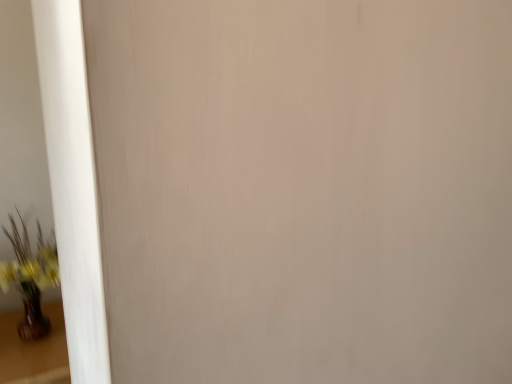
Question: Is brown glossy vase at lower left smaller than matte brown vase at lower left?

Choices:
 (A) yes
 (B) no

Answer: (B)

Question: Is brown glossy vase at lower left taller than matte brown vase at lower left?

Choices:
 (A) no
 (B) yes

Answer: (A)

Question: From a real-world perspective, is brown glossy vase at lower left located beneath matte brown vase at lower left?

Choices:
 (A) no
 (B) yes

Answer: (B)

Question: Is brown glossy vase at lower left outside matte brown vase at lower left?

Choices:
 (A) yes
 (B) no

Answer: (A)

Question: Is brown glossy vase at lower left closer to the viewer compared to matte brown vase at lower left?

Choices:
 (A) yes
 (B) no

Answer: (A)

Question: Considering the relative sizes of brown glossy vase at lower left and matte brown vase at lower left in the image provided, is brown glossy vase at lower left shorter than matte brown vase at lower left?

Choices:
 (A) no
 (B) yes

Answer: (B)

Question: Is matte brown vase at lower left shorter than brown glossy vase at lower left?

Choices:
 (A) yes
 (B) no

Answer: (B)

Question: Is matte brown vase at lower left closer to the viewer compared to brown glossy vase at lower left?

Choices:
 (A) yes
 (B) no

Answer: (B)

Question: Does matte brown vase at lower left appear on the left side of brown glossy vase at lower left?

Choices:
 (A) yes
 (B) no

Answer: (B)

Question: Is matte brown vase at lower left with brown glossy vase at lower left?

Choices:
 (A) yes
 (B) no

Answer: (B)

Question: From the image's perspective, is matte brown vase at lower left over brown glossy vase at lower left?

Choices:
 (A) yes
 (B) no

Answer: (A)

Question: From the image's perspective, does matte brown vase at lower left appear lower than brown glossy vase at lower left?

Choices:
 (A) no
 (B) yes

Answer: (A)

Question: Considering the positions of matte brown vase at lower left and brown glossy vase at lower left in the image, is matte brown vase at lower left wider or thinner than brown glossy vase at lower left?

Choices:
 (A) wide
 (B) thin

Answer: (B)